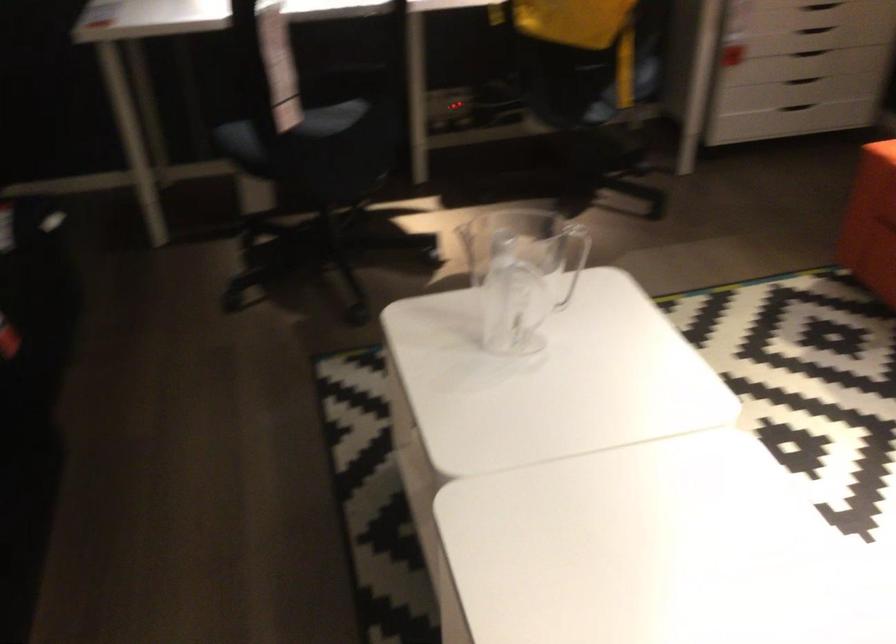
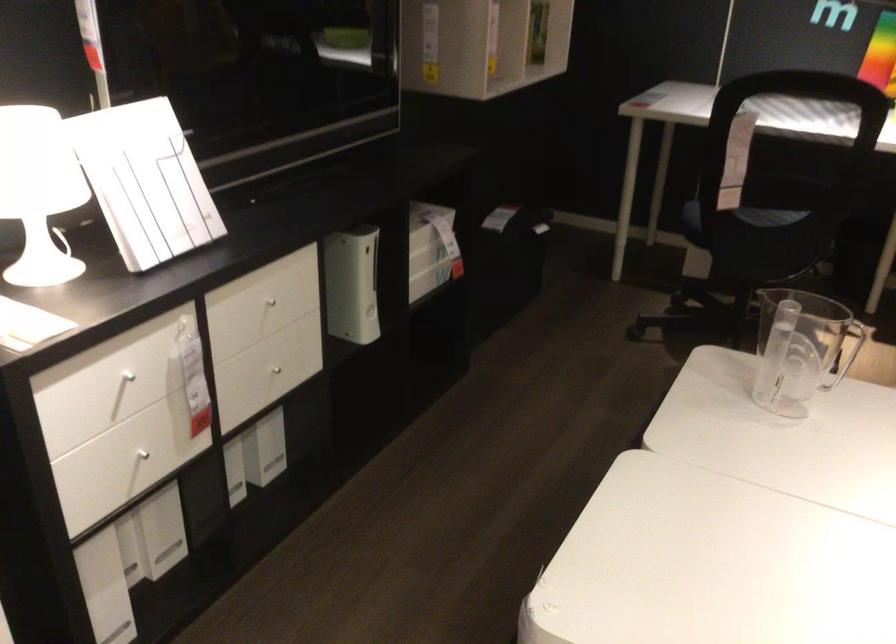
Where in the second image is the point corresponding to point 296,147 from the first image?

(739, 218)